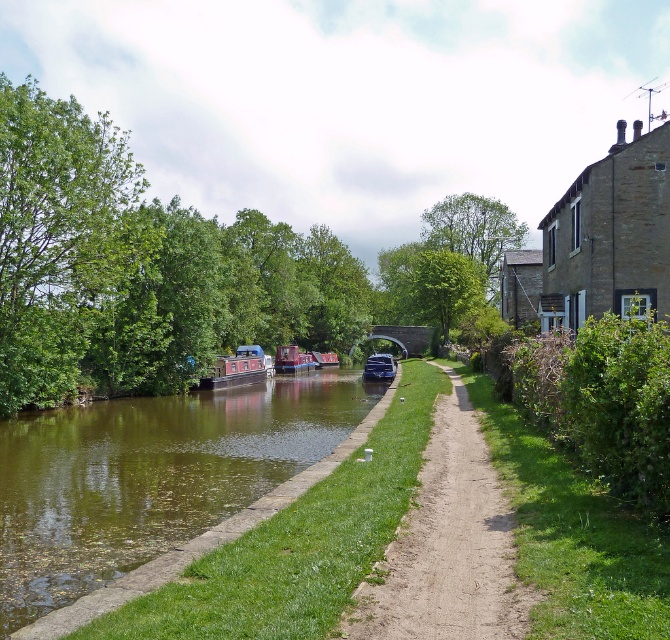
Question: Which of the following is the farthest from the observer?

Choices:
 (A) (385, 369)
 (B) (243, 356)
 (C) (291, 348)

Answer: (C)

Question: In this image, where is matte blue boat at center located relative to metallic blue boat at center?

Choices:
 (A) right
 (B) left

Answer: (B)

Question: Is green smooth water at center closer to camera compared to green grass at center?

Choices:
 (A) no
 (B) yes

Answer: (A)

Question: Which point is farther to the camera?

Choices:
 (A) green smooth water at center
 (B) metallic blue boat at center
 (C) green grass at center
 (D) matte red canal boat at center

Answer: (B)

Question: Is green smooth water at center to the right of matte blue boat at center from the viewer's perspective?

Choices:
 (A) no
 (B) yes

Answer: (B)

Question: Considering the real-world distances, which object is closest to the matte blue boat at center?

Choices:
 (A) matte red canal boat at center
 (B) metallic blue boat at center
 (C) green grass at center
 (D) green smooth water at center

Answer: (A)